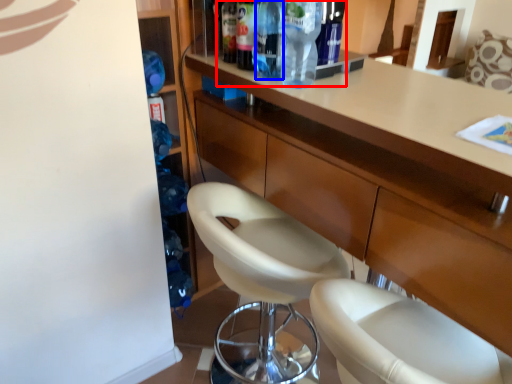
Question: Which of the following is the closest to the observer, bottle (highlighted by a red box) or bottle (highlighted by a blue box)?

Choices:
 (A) bottle
 (B) bottle

Answer: (A)